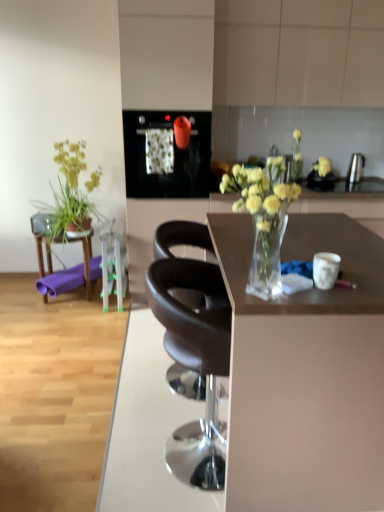
The image size is (384, 512). I want to click on free location to the left of matte brown chair at center, which is the 2th chair in back-to-front order, so click(100, 457).